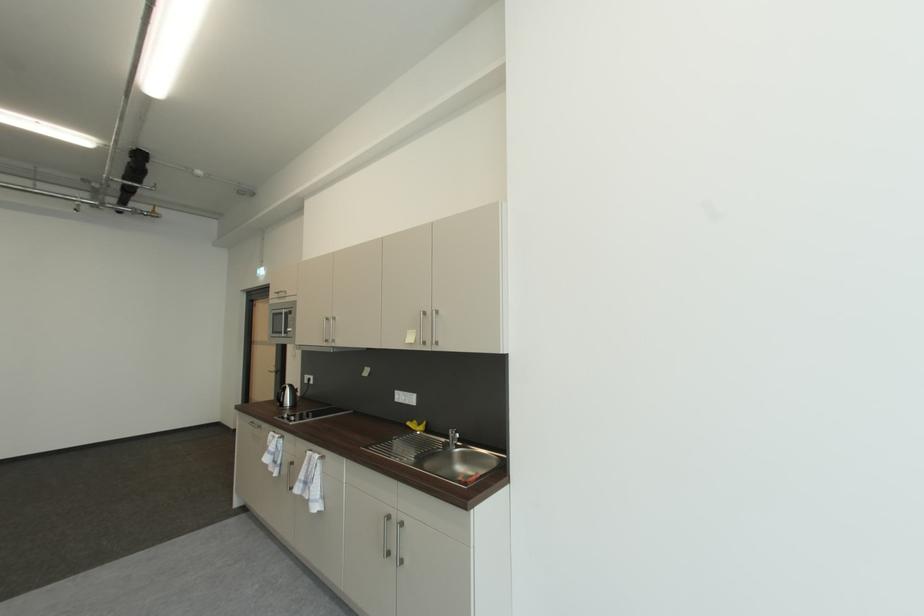
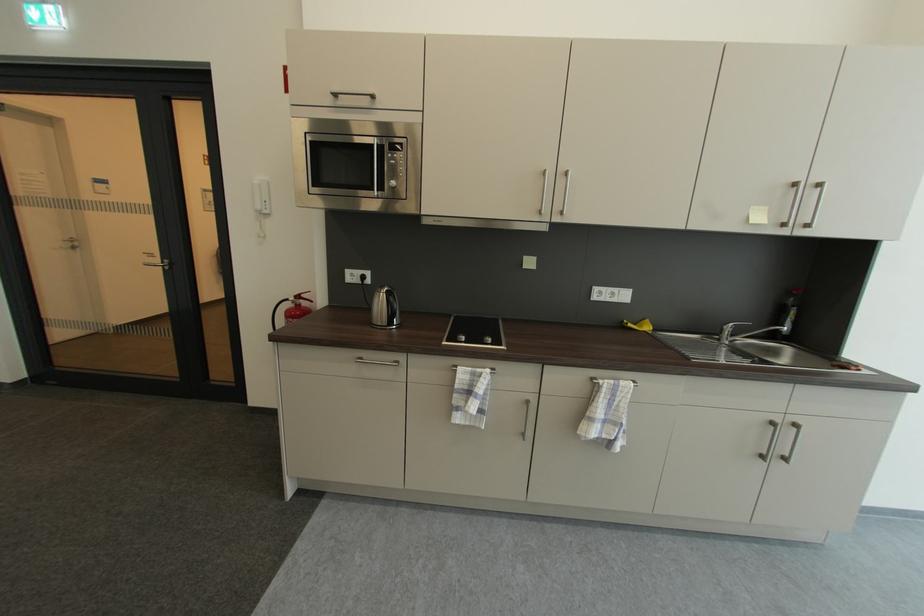
Question: I am providing you with two images of the same scene from different viewpoints. Which of the following objects are not visible in image2?

Choices:
 (A) sink faucet handle
 (B) microwave control button
 (C) black kettle handle
 (D) none of these

Answer: (D)